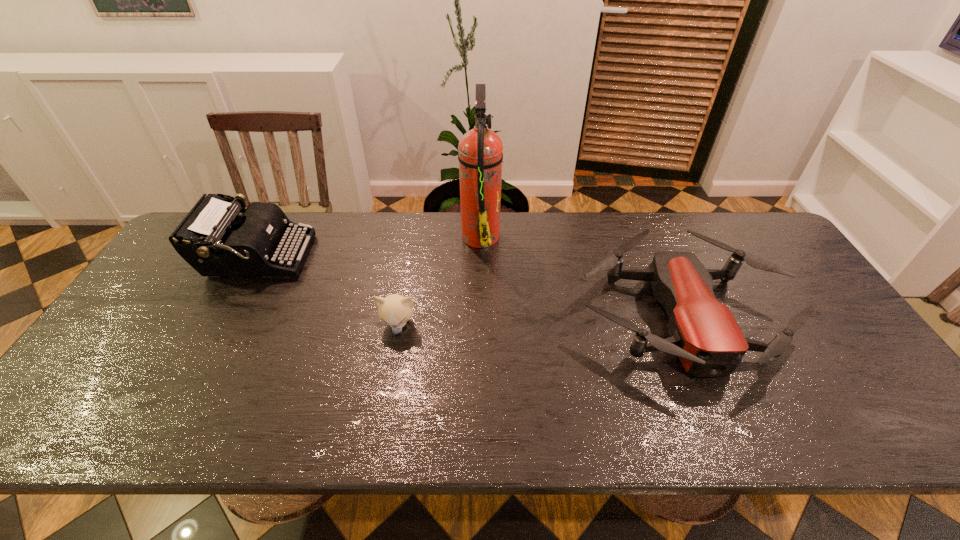
This screenshot has height=540, width=960. In the image, there is a desktop. What are the coordinates of `blank space at the near edge` in the screenshot? It's located at click(843, 437).

In the image, there is a desktop. Where is `vacant space at the left edge`? The image size is (960, 540). vacant space at the left edge is located at coordinates (119, 350).

Find the location of a particular element. This screenshot has width=960, height=540. vacant space at the right edge is located at coordinates (831, 381).

Where is `free space at the far right corner of the desktop`? free space at the far right corner of the desktop is located at coordinates (741, 235).

This screenshot has height=540, width=960. In order to click on free area in between the kitten and the drone in this screenshot , I will do `click(540, 320)`.

The image size is (960, 540). Identify the location of free point between the rightmost object and the leftmost object. (469, 286).

The width and height of the screenshot is (960, 540). In order to click on vacant area between the third object from left to right and the leftmost object in this screenshot , I will do `click(369, 246)`.

Find the location of a particular element. This screenshot has width=960, height=540. free spot between the tallest object and the rightmost object is located at coordinates (581, 275).

Find the location of `unoccupied area between the second object from left to right and the fire extinguisher`. unoccupied area between the second object from left to right and the fire extinguisher is located at coordinates (440, 280).

Where is `vacant region between the fire extinguisher and the leftmost object`? This screenshot has width=960, height=540. vacant region between the fire extinguisher and the leftmost object is located at coordinates (369, 246).